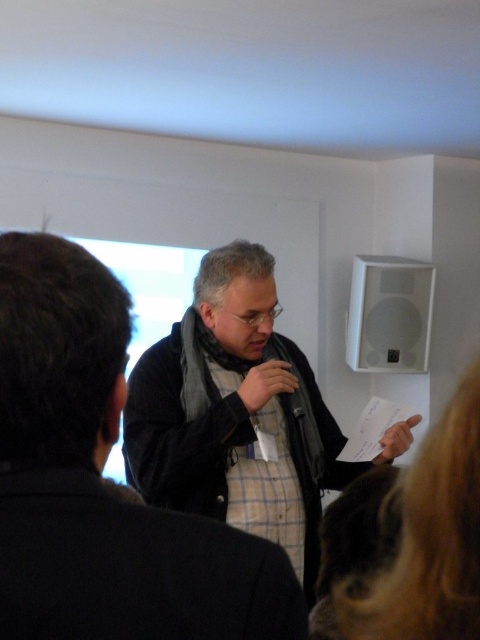
You are an assistant at a conference venue and need to adjust the seating arrangement. You see the dark gray fabric jacket at center and the matte black jacket at center. Which jacket should you move if you want to make space for a new attendee who needs to sit between the two jackets?

You should move the dark gray fabric jacket at center because it is in front of the matte black jacket at center, so moving it would create space between them for the new attendee.

You are an interior designer assessing the space for a new speaker system. The speaker currently mounted on the wall is directly behind the dark gray fabric jacket at center. If you want to place a new speaker to the right of the existing one, which object should you avoid placing it near to ensure it doesn,t block the blonde hair at lower right?

You should avoid placing the new speaker near the dark gray fabric jacket at center because its width surpasses that of the blonde hair at lower right, so positioning the new speaker to the right of the existing one near the dark gray fabric jacket at center might block the view of the blonde hair at lower right.